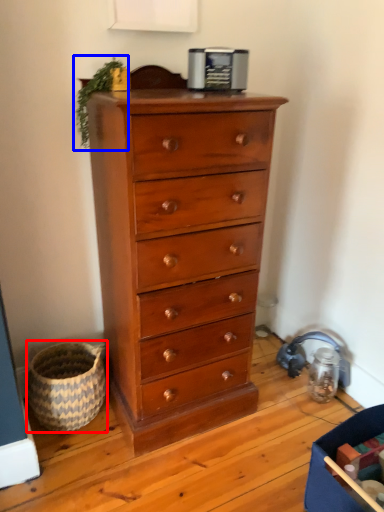
Question: Which object appears farthest to the camera in this image, basket (highlighted by a red box) or plant (highlighted by a blue box)?

Choices:
 (A) basket
 (B) plant

Answer: (A)